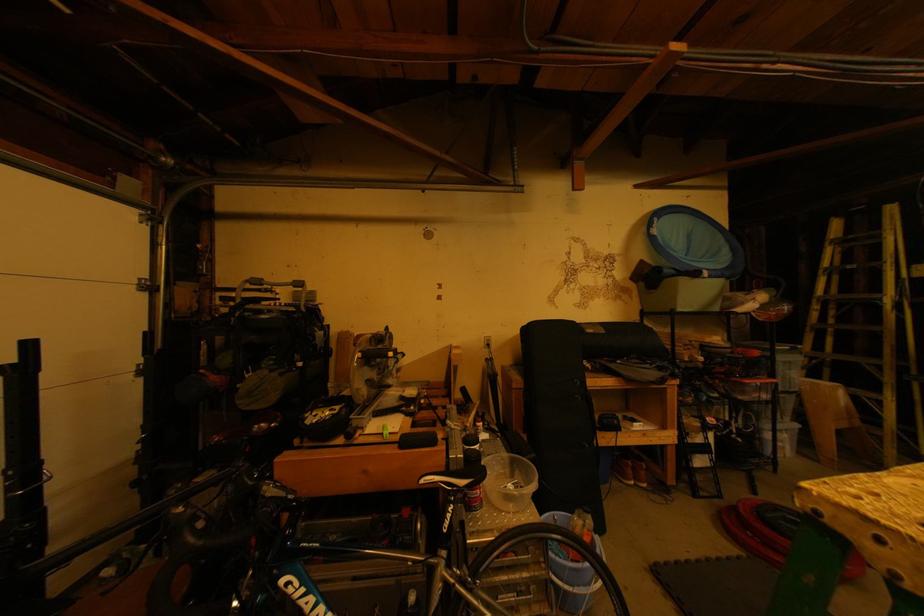
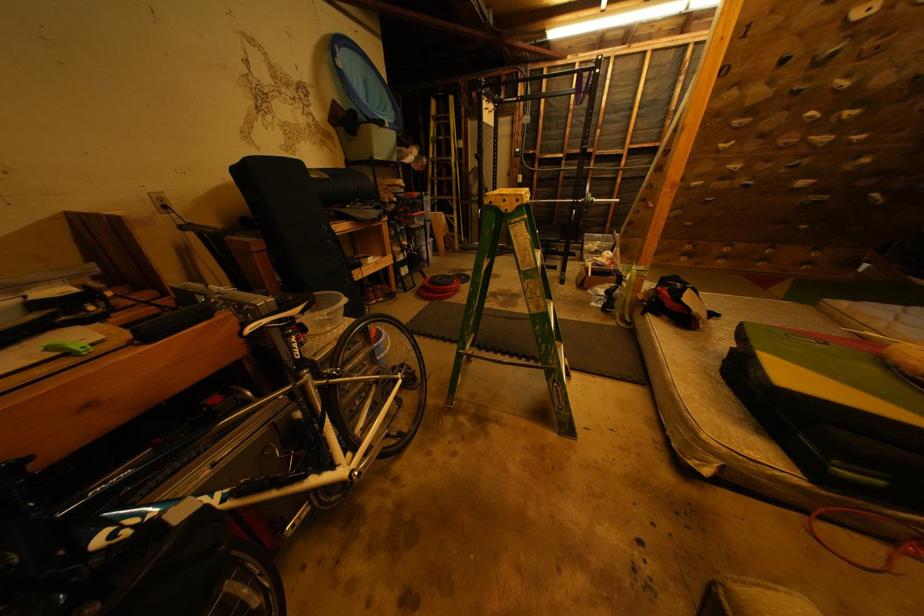
First-person continuous shooting, in which direction is the camera rotating?

The camera rotated toward right-down.